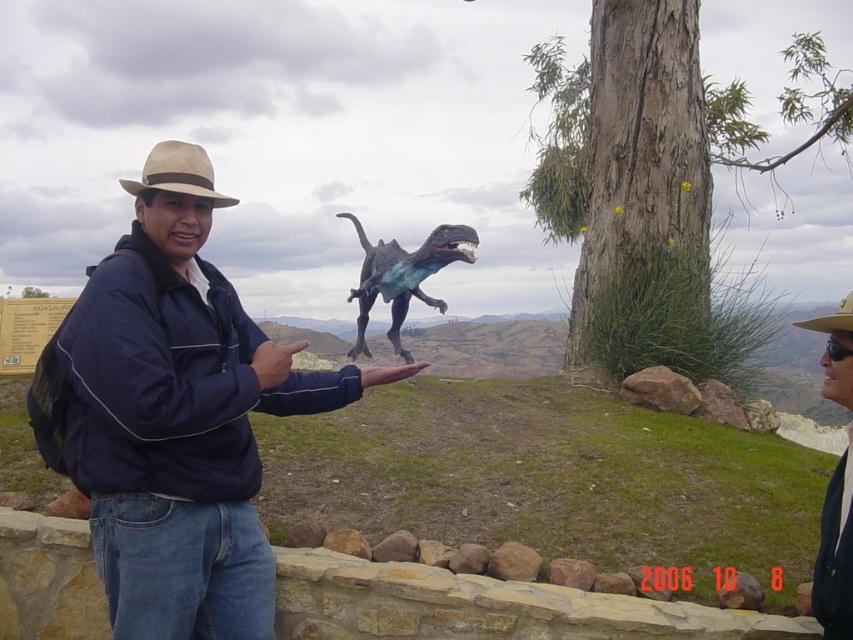
You are a photographer setting up a shot of the man in the scene. You need to position your camera so that the matte black jacket at lower right and the beige straw cowboy hat at upper left are both visible in the frame. Which object should you ensure is closer to the bottom of the frame?

The matte black jacket at lower right should be closer to the bottom of the frame because it is positioned below the beige straw cowboy hat at upper left.

You are standing in the scene and want to pick up the matte black jacket at lower right. According to the coordinates provided in the Objects Description, where exactly should you look to find it?

The matte black jacket at lower right is located at point (834, 552), so you should look towards the lower right area of the image to find it.